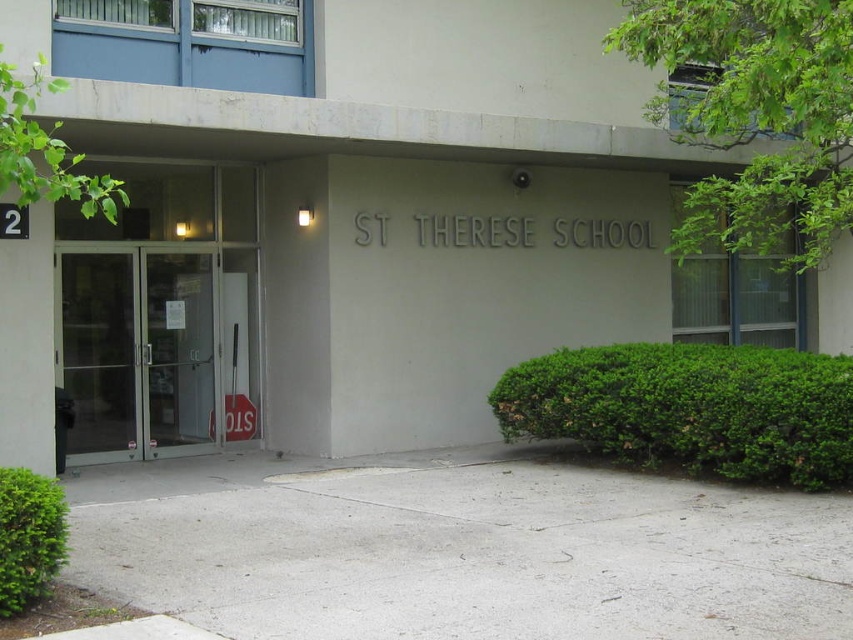
Question: Observing the image, what is the correct spatial positioning of transparent glass doors at center in reference to green leafy tree at upper left?

Choices:
 (A) below
 (B) above

Answer: (A)

Question: Which point is farther to the camera?

Choices:
 (A) (0, 524)
 (B) (91, 186)
 (C) (213, 392)
 (D) (706, 296)

Answer: (D)

Question: Observing the image, what is the correct spatial positioning of green leafy bush at lower right in reference to transparent glass doors at center?

Choices:
 (A) right
 (B) left

Answer: (A)

Question: Which point is closer to the camera?

Choices:
 (A) green leafy tree at upper left
 (B) green leafy bush at lower right
 (C) clear glass window at upper right

Answer: (A)

Question: Which of the following is the closest to the observer?

Choices:
 (A) (157, 336)
 (B) (44, 573)
 (C) (25, 188)

Answer: (C)

Question: Is green leafy bush at lower right bigger than clear glass window at upper right?

Choices:
 (A) yes
 (B) no

Answer: (A)